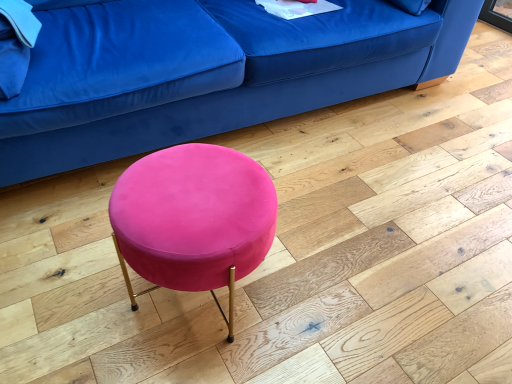
Question: Are velvet blue couch at upper center and velvet pink stool at center located far from each other?

Choices:
 (A) yes
 (B) no

Answer: (B)

Question: Could you tell me if velvet blue couch at upper center is facing velvet pink stool at center?

Choices:
 (A) yes
 (B) no

Answer: (A)

Question: Is velvet blue couch at upper center smaller than velvet pink stool at center?

Choices:
 (A) no
 (B) yes

Answer: (A)

Question: Considering the relative sizes of velvet blue couch at upper center and velvet pink stool at center in the image provided, is velvet blue couch at upper center shorter than velvet pink stool at center?

Choices:
 (A) no
 (B) yes

Answer: (A)

Question: Is velvet blue couch at upper center turned away from velvet pink stool at center?

Choices:
 (A) no
 (B) yes

Answer: (A)

Question: From the image's perspective, is velvet blue couch at upper center beneath velvet pink stool at center?

Choices:
 (A) yes
 (B) no

Answer: (B)

Question: Does velvet pink stool at center appear on the right side of velvet blue couch at upper center?

Choices:
 (A) no
 (B) yes

Answer: (A)

Question: Is velvet pink stool at center further to the viewer compared to velvet blue couch at upper center?

Choices:
 (A) no
 (B) yes

Answer: (A)

Question: Does velvet pink stool at center have a greater width compared to velvet blue couch at upper center?

Choices:
 (A) no
 (B) yes

Answer: (A)

Question: Is velvet pink stool at center positioned with its back to velvet blue couch at upper center?

Choices:
 (A) yes
 (B) no

Answer: (A)

Question: From a real-world perspective, is velvet pink stool at center physically below velvet blue couch at upper center?

Choices:
 (A) no
 (B) yes

Answer: (B)

Question: From the image's perspective, is velvet pink stool at center located above velvet blue couch at upper center?

Choices:
 (A) yes
 (B) no

Answer: (B)

Question: From a real-world perspective, is velvet blue couch at upper center above or below velvet pink stool at center?

Choices:
 (A) above
 (B) below

Answer: (A)